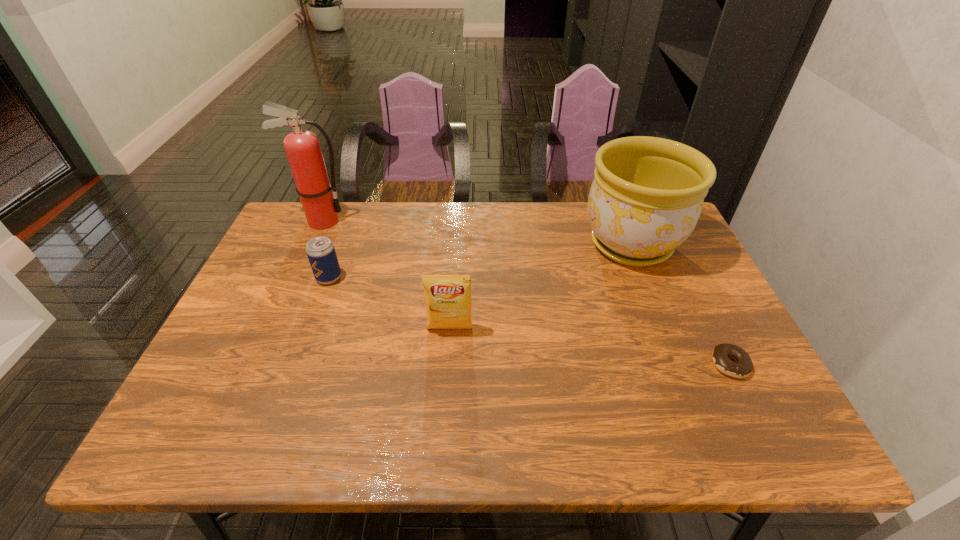
At what (x,y) coordinates should I click in order to perform the action: click on vacant point located between the crisp (potato chip) and the shortest object. Please return your answer as a coordinate pair (x, y). The height and width of the screenshot is (540, 960). Looking at the image, I should click on pos(590,347).

Locate an element on the screen. vacant area between the crisp (potato chip) and the fire extinguisher is located at coordinates (386, 275).

You are a GUI agent. You are given a task and a screenshot of the screen. Output one action in this format:
    pyautogui.click(x=<x>, y=<y>)
    Task: Click on the free space that is in between the second shortest object and the nearest object
    This screenshot has height=540, width=960.
    Given the screenshot: What is the action you would take?
    pyautogui.click(x=530, y=321)

Select which object appears as the closest to the tallest object. Please provide its 2D coordinates. Your answer should be formatted as a tuple, i.e. [(x, y)], where the tuple contains the x and y coordinates of a point satisfying the conditions above.

[(321, 253)]

Identify which object is the nearest to the shortest object. Please provide its 2D coordinates. Your answer should be formatted as a tuple, i.e. [(x, y)], where the tuple contains the x and y coordinates of a point satisfying the conditions above.

[(646, 197)]

Identify the location of free location that satisfies the following two spatial constraints: 1. on the hose direction of the fire extinguisher; 2. on the back side of the shortest object. (259, 364).

The width and height of the screenshot is (960, 540). What are the coordinates of `free space that satisfies the following two spatial constraints: 1. on the hose direction of the fire extinguisher; 2. on the right side of the second shortest object` in the screenshot? It's located at (298, 278).

At what (x,y) coordinates should I click in order to perform the action: click on free space that satisfies the following two spatial constraints: 1. on the hose direction of the tallest object; 2. on the right side of the second shortest object. Please return your answer as a coordinate pair (x, y). Image resolution: width=960 pixels, height=540 pixels. Looking at the image, I should click on (298, 278).

The height and width of the screenshot is (540, 960). Find the location of `free region that satisfies the following two spatial constraints: 1. on the front of the doughnut with the logo; 2. on the right side of the third object from left to right`. free region that satisfies the following two spatial constraints: 1. on the front of the doughnut with the logo; 2. on the right side of the third object from left to right is located at coordinates (447, 364).

In order to click on free space that satisfies the following two spatial constraints: 1. on the back side of the shortest object; 2. on the hose direction of the tallest object in this screenshot , I will do `click(659, 221)`.